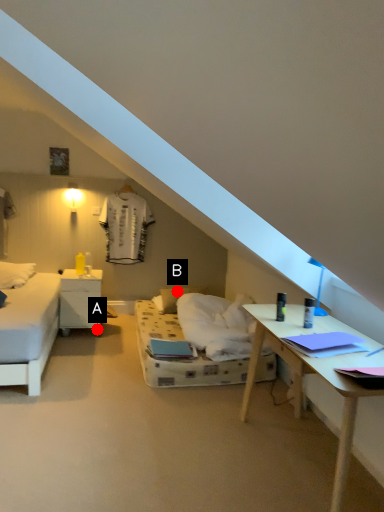
Question: Two points are circled on the image, labeled by A and B beside each circle. Which point is closer to the camera taking this photo?

Choices:
 (A) A is closer
 (B) B is closer

Answer: (A)